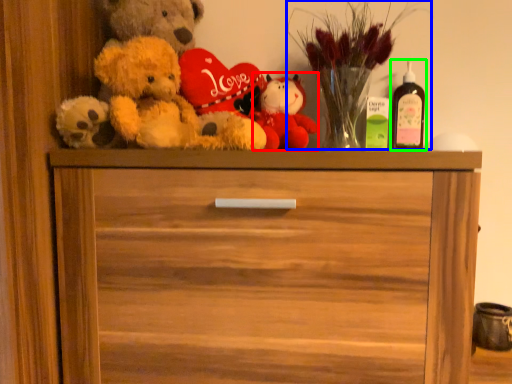
Question: Estimate the real-world distances between objects in this image. Which object is closer to toy (highlighted by a red box), floral arrangement (highlighted by a blue box) or wine bottle (highlighted by a green box)?

Choices:
 (A) floral arrangement
 (B) wine bottle

Answer: (A)